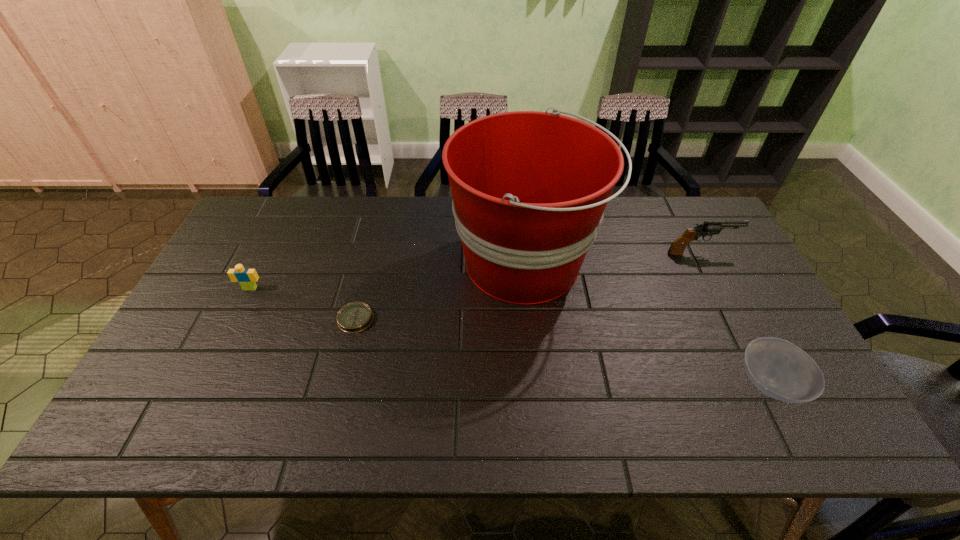
Where is `vacant area at the near edge`? The image size is (960, 540). vacant area at the near edge is located at coordinates (507, 408).

Identify the location of vacant space at the left edge of the desktop. Image resolution: width=960 pixels, height=540 pixels. (219, 275).

Find the location of a particular element. Image resolution: width=960 pixels, height=540 pixels. vacant space at the far left corner is located at coordinates (274, 217).

The image size is (960, 540). What are the coordinates of `vacant space at the near right corner` in the screenshot? It's located at (823, 411).

You are a GUI agent. You are given a task and a screenshot of the screen. Output one action in this format:
    pyautogui.click(x=<x>, y=<y>)
    Task: Click on the vacant space that's between the fourth tallest object and the gun
    This screenshot has width=960, height=540.
    Given the screenshot: What is the action you would take?
    pyautogui.click(x=734, y=318)

At what (x,y) coordinates should I click in order to perform the action: click on vacant area that lies between the leftmost object and the bucket. Please return your answer as a coordinate pair (x, y). The height and width of the screenshot is (540, 960). Looking at the image, I should click on (388, 276).

Where is `blank region between the fourth shortest object and the third object from left to right`? The width and height of the screenshot is (960, 540). blank region between the fourth shortest object and the third object from left to right is located at coordinates (613, 258).

You are a GUI agent. You are given a task and a screenshot of the screen. Output one action in this format:
    pyautogui.click(x=<x>, y=<y>)
    Task: Click on the free space that is in between the shortest object and the bucket
    The image size is (960, 540).
    Given the screenshot: What is the action you would take?
    tap(441, 292)

Locate an element on the screen. blank region between the tallest object and the Lego is located at coordinates (388, 276).

The width and height of the screenshot is (960, 540). In order to click on free point between the second tallest object and the nearest object in this screenshot , I will do `click(734, 318)`.